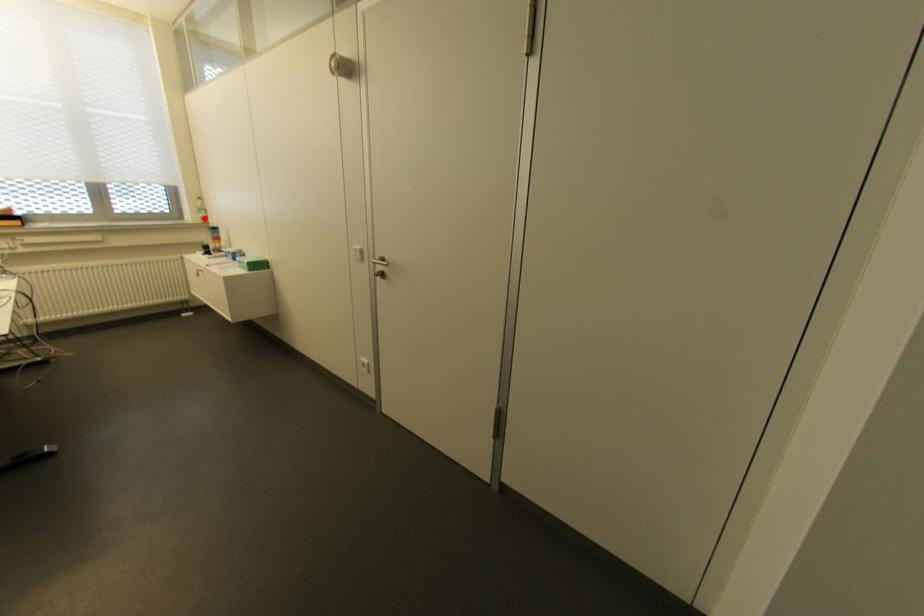
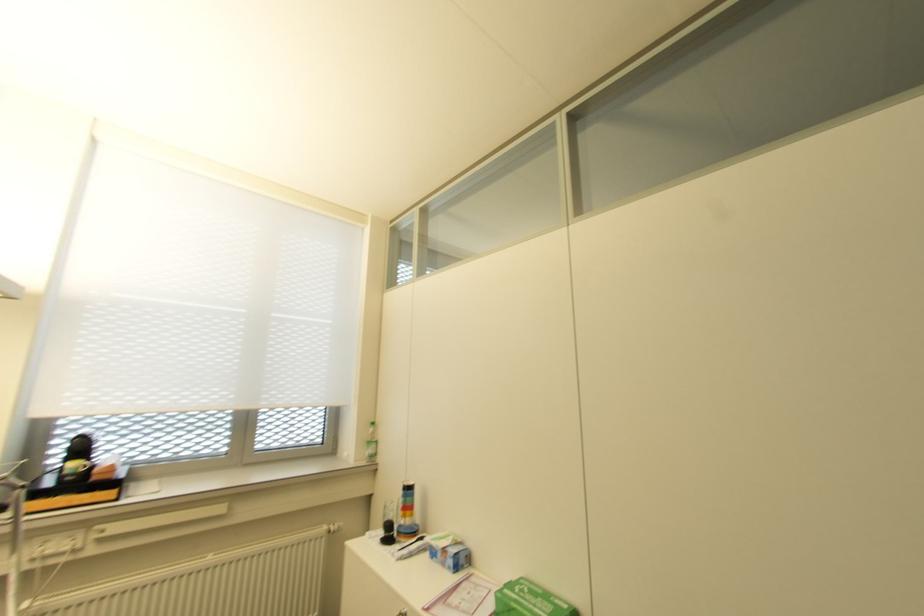
In the second image, find the point that corresponds to the highlighted location in the first image.

(372, 455)